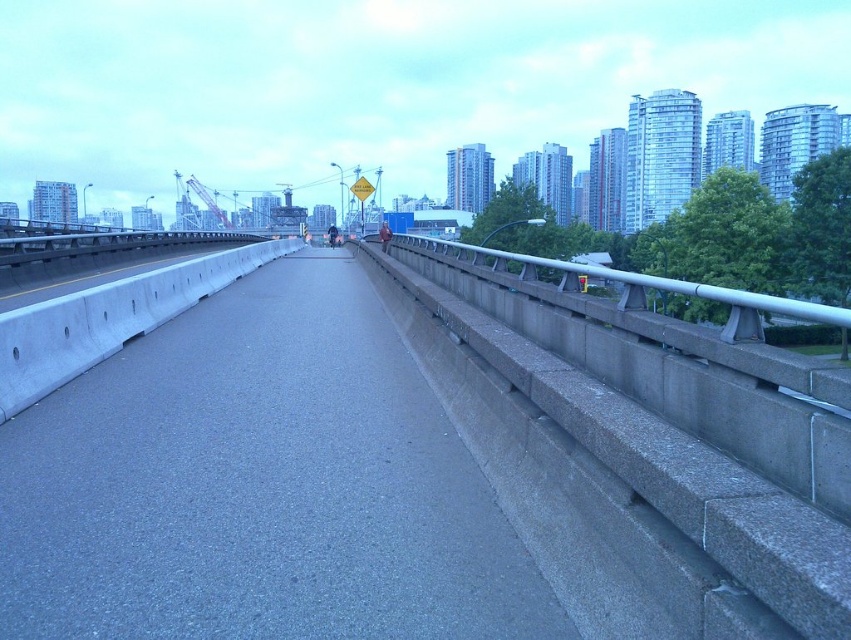
Does point (369, 289) come in front of point (849, 385)?

No, (369, 289) is further to viewer.

The image size is (851, 640). I want to click on gray concrete highway at center, so pyautogui.click(x=258, y=484).

Who is more forward, (473, 568) or (494, 278)?

Point (473, 568) is more forward.

The image size is (851, 640). Identify the location of gray concrete highway at center. (258, 484).

In the scene shown: Can you confirm if metallic gray rail at right is positioned above silver metallic rail at right?

No, metallic gray rail at right is not above silver metallic rail at right.

Between metallic gray rail at right and silver metallic rail at right, which one is positioned lower?

metallic gray rail at right

Who is more distant from viewer, (430, 257) or (638, 300)?

The point (430, 257) is more distant.

At what (x,y) coordinates should I click in order to perform the action: click on metallic gray rail at right. Please return your answer as a coordinate pair (x, y). Looking at the image, I should click on (640, 449).

Which is behind, point (109, 513) or point (677, 288)?

Point (677, 288)

Between gray concrete highway at center and silver metallic rail at right, which one is positioned lower?

Positioned lower is gray concrete highway at center.

Which is in front, point (241, 307) or point (498, 259)?

Point (498, 259)

Locate an element on the screen. This screenshot has height=640, width=851. gray concrete highway at center is located at coordinates (258, 484).